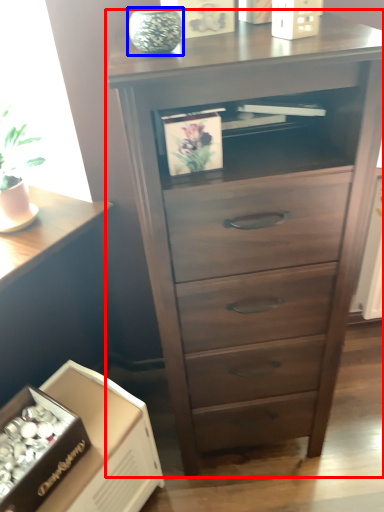
Question: Which object is further to the camera taking this photo, chest of drawers (highlighted by a red box) or glass vase (highlighted by a blue box)?

Choices:
 (A) chest of drawers
 (B) glass vase

Answer: (B)